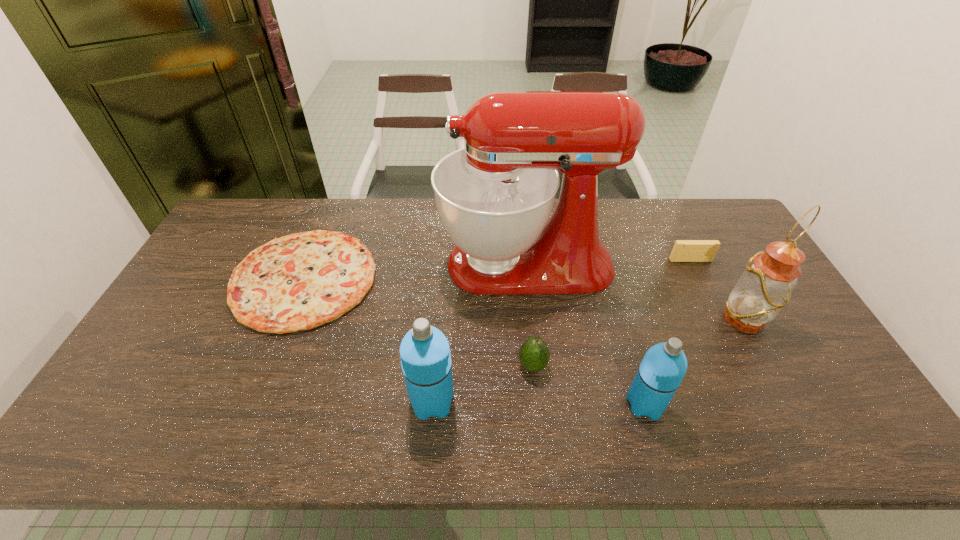
Image resolution: width=960 pixels, height=540 pixels. Find the location of `the third shortest object`. the third shortest object is located at coordinates (534, 354).

Where is `vacant space situated 0.140m on the right of the third tallest object`? The image size is (960, 540). vacant space situated 0.140m on the right of the third tallest object is located at coordinates (512, 402).

Find the location of a particular element. Image resolution: width=960 pixels, height=540 pixels. free region located on the back of the shorter thermos bottle is located at coordinates (633, 361).

Locate an element on the screen. vacant area located 0.180m at the front of the sixth tallest object with spools is located at coordinates (712, 305).

Image resolution: width=960 pixels, height=540 pixels. Identify the location of vacant region located on the right of the leftmost object. (466, 279).

Find the location of a particular element. This screenshot has height=540, width=960. free region located at the attachment hub of the tallest object is located at coordinates point(380,264).

This screenshot has height=540, width=960. Identify the location of vacant space located 0.340m at the attachment hub of the tallest object. (333, 264).

At what (x,y) coordinates should I click in order to perform the action: click on vacant space located at the attachment hub of the tallest object. Please return your answer as a coordinate pair (x, y). The image size is (960, 540). Looking at the image, I should click on (368, 264).

Locate an element on the screen. The width and height of the screenshot is (960, 540). free space located 0.290m on the back of the second tallest object is located at coordinates (700, 239).

In order to click on vacant space situated 0.050m on the front of the third shortest object in this screenshot , I will do `click(536, 396)`.